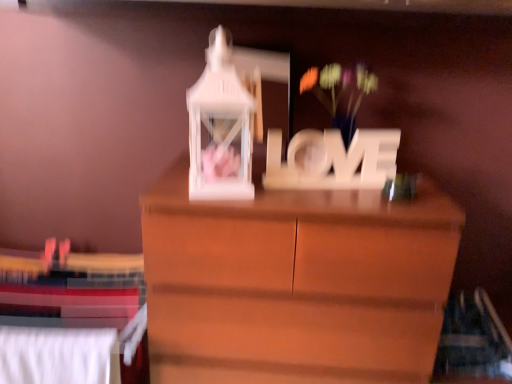
Question: Can you confirm if white matte floral arrangement at center is positioned to the right of white fabric bed at lower left?

Choices:
 (A) yes
 (B) no

Answer: (A)

Question: Does white matte floral arrangement at center appear on the left side of white fabric bed at lower left?

Choices:
 (A) no
 (B) yes

Answer: (A)

Question: From the image's perspective, is white matte floral arrangement at center beneath white fabric bed at lower left?

Choices:
 (A) yes
 (B) no

Answer: (B)

Question: From a real-world perspective, is white matte floral arrangement at center under white fabric bed at lower left?

Choices:
 (A) no
 (B) yes

Answer: (A)

Question: Does white matte floral arrangement at center contain white fabric bed at lower left?

Choices:
 (A) yes
 (B) no

Answer: (B)

Question: In terms of width, does white matte floral arrangement at center look wider or thinner when compared to white fabric bed at lower left?

Choices:
 (A) wide
 (B) thin

Answer: (A)

Question: Considering the positions of point (330, 122) and point (25, 317), is point (330, 122) closer or farther from the camera than point (25, 317)?

Choices:
 (A) closer
 (B) farther

Answer: (B)

Question: From a real-world perspective, is white matte floral arrangement at center physically located above or below white fabric bed at lower left?

Choices:
 (A) above
 (B) below

Answer: (A)

Question: From their relative heights in the image, would you say white matte floral arrangement at center is taller or shorter than white fabric bed at lower left?

Choices:
 (A) tall
 (B) short

Answer: (B)

Question: From the image's perspective, relative to white fabric bed at lower left, is wooden "love" sign at center above or below?

Choices:
 (A) below
 (B) above

Answer: (B)

Question: Is wooden "love" sign at center situated inside white fabric bed at lower left or outside?

Choices:
 (A) outside
 (B) inside

Answer: (A)

Question: In terms of height, does wooden "love" sign at center look taller or shorter compared to white fabric bed at lower left?

Choices:
 (A) tall
 (B) short

Answer: (B)

Question: Is wooden "love" sign at center wider or thinner than white fabric bed at lower left?

Choices:
 (A) wide
 (B) thin

Answer: (A)

Question: Based on their sizes in the image, would you say white matte floral arrangement at center is bigger or smaller than wooden "love" sign at center?

Choices:
 (A) big
 (B) small

Answer: (A)

Question: Is white matte floral arrangement at center taller or shorter than wooden "love" sign at center?

Choices:
 (A) tall
 (B) short

Answer: (A)